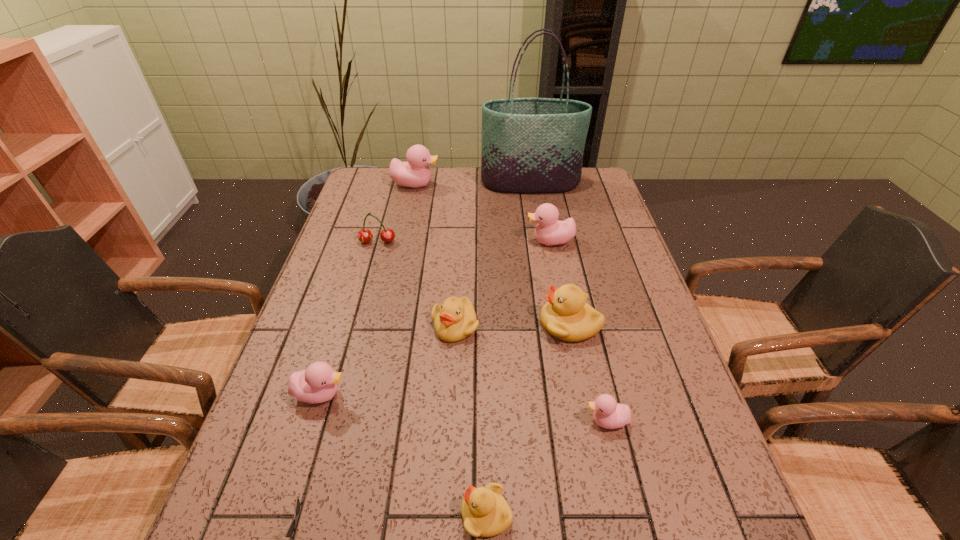
Locate an element on the screen. the smallest pink duckling is located at coordinates point(608,414).

Find the location of a particular element. Image resolution: width=960 pixels, height=540 pixels. free spot located on the front of the tote bag is located at coordinates (536, 217).

This screenshot has height=540, width=960. In order to click on blank space located 0.100m on the front-facing side of the farthest pink duckling in this screenshot , I will do `click(468, 184)`.

Find the location of a particular element. Image resolution: width=960 pixels, height=540 pixels. free spot located on the front-facing side of the third smallest pink duckling is located at coordinates (429, 241).

Locate an element on the screen. The image size is (960, 540). vacant position located 0.270m on the front-facing side of the third smallest pink duckling is located at coordinates (439, 241).

Identify the location of free space located 0.130m on the front-facing side of the third smallest pink duckling. This screenshot has width=960, height=540. (484, 241).

Where is `free space located on the front-facing side of the biggest yellow duckling`? free space located on the front-facing side of the biggest yellow duckling is located at coordinates (472, 324).

Find the location of a particular element. This screenshot has height=540, width=960. free space located on the front-facing side of the biggest yellow duckling is located at coordinates (389, 324).

Where is `vacant region located on the front-facing side of the biggest yellow duckling`? The height and width of the screenshot is (540, 960). vacant region located on the front-facing side of the biggest yellow duckling is located at coordinates (x=489, y=324).

The height and width of the screenshot is (540, 960). What are the coordinates of `blank space located with stems pointing upwards on the cherry` in the screenshot? It's located at [357, 314].